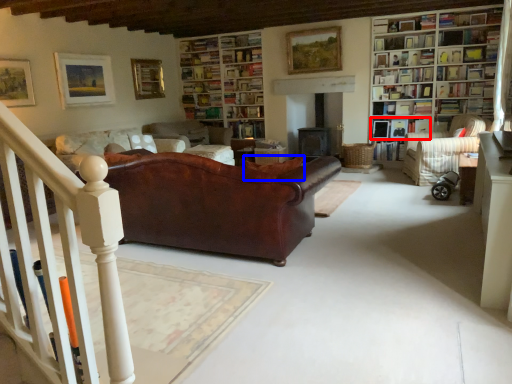
Question: Which point is further to the camera, book (highlighted by a red box) or cushion (highlighted by a blue box)?

Choices:
 (A) book
 (B) cushion

Answer: (A)